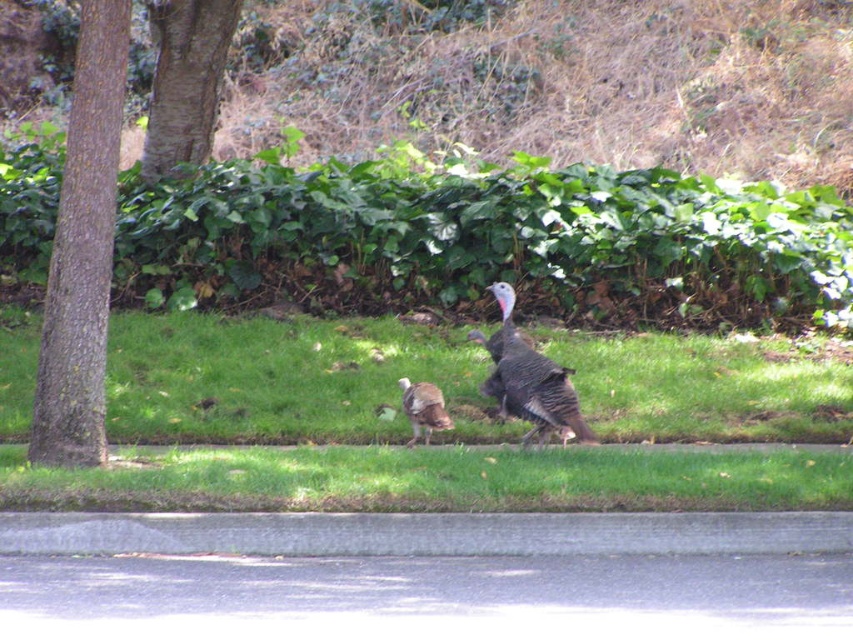
You are standing at a point 10 meters away from the road. You want to approach the point marked at coordinates point (276, 429). How much further do you need to walk to reach that point?

The distance between point (276, 429) and the viewer is 11.76 meters. Since you are already 10 meters away from the road, you need to walk an additional 1.76 meters to reach the point.

You are a photographer trying to capture a closeup of the brown feathered turkey at center. You are currently standing on the paved road with a curb separating the grass from the roadway. Can you step onto the green grass at center without stepping on the turkey?

The green grass at center is larger in size than brown feathered turkey at center, so yes, you can step onto the green grass at center without stepping on the turkey since there is enough space between them.

You are standing at the point with coordinates point (x=410, y=392) and want to walk towards the road. Which direction should you go to avoid the turkey at point (x=548, y=365)?

Since point (x=548, y=365) is in front of point (x=410, y=392), you should walk in the opposite direction to avoid the turkey at point (x=548, y=365) and head toward the road.